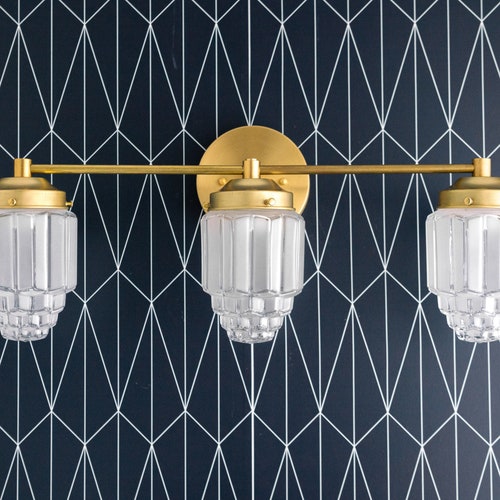
At what (x,y) coordinates should I click in order to perform the action: click on light rings. Please return your answer as a coordinate pair (x, y). This screenshot has height=500, width=500. Looking at the image, I should click on (50, 206), (284, 206), (482, 204).